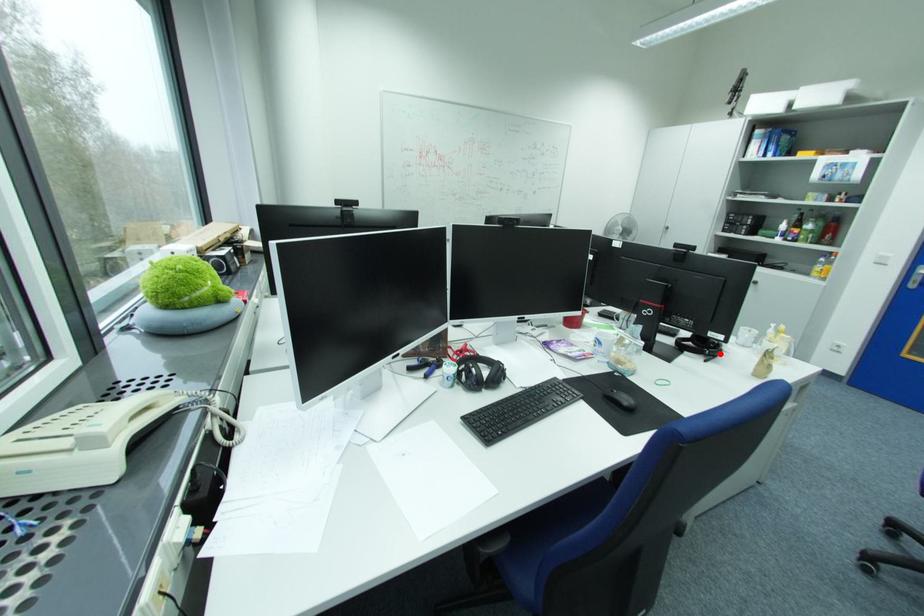
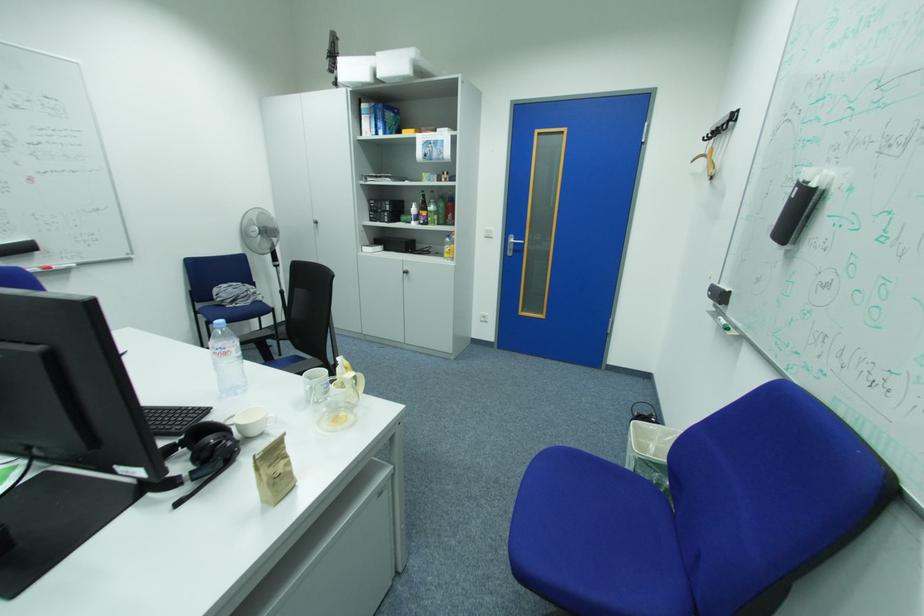
Where in the second image is the point corresponding to the highlighted location from the first image?

(203, 476)